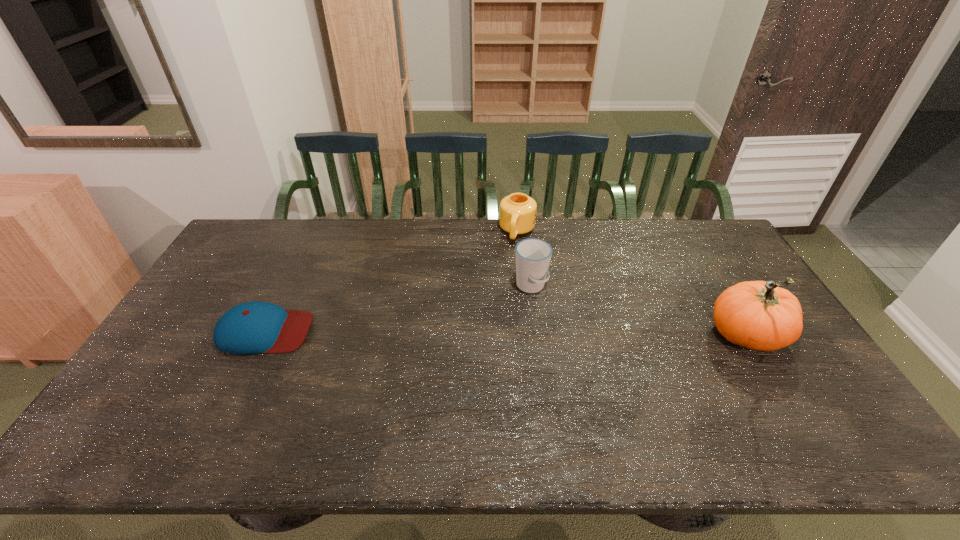
Find the location of a particular element. free space located with a handle on the side of the second farthest object is located at coordinates (575, 357).

This screenshot has width=960, height=540. Find the location of `vacant region located 0.050m on the handle side of the mug`. vacant region located 0.050m on the handle side of the mug is located at coordinates (513, 254).

The image size is (960, 540). Find the location of `free space located on the handle side of the mug`. free space located on the handle side of the mug is located at coordinates (505, 278).

The height and width of the screenshot is (540, 960). Identify the location of vacant space located on the handle side of the mug. (504, 282).

Locate an element on the screen. The image size is (960, 540). object located in the far edge section of the desktop is located at coordinates (517, 211).

What are the coordinates of `object that is at the left edge` in the screenshot? It's located at point(256,327).

Identify the location of object that is at the right edge. (758, 315).

Identify the location of vacant region at the far edge of the desktop. The image size is (960, 540). (600, 254).

You are a GUI agent. You are given a task and a screenshot of the screen. Output one action in this format:
    pyautogui.click(x=<x>, y=<y>)
    Task: Click on the vacant region at the near edge of the desktop
    The height and width of the screenshot is (540, 960).
    Given the screenshot: What is the action you would take?
    pyautogui.click(x=519, y=386)

Locate an element on the screen. free space at the left edge is located at coordinates (210, 276).